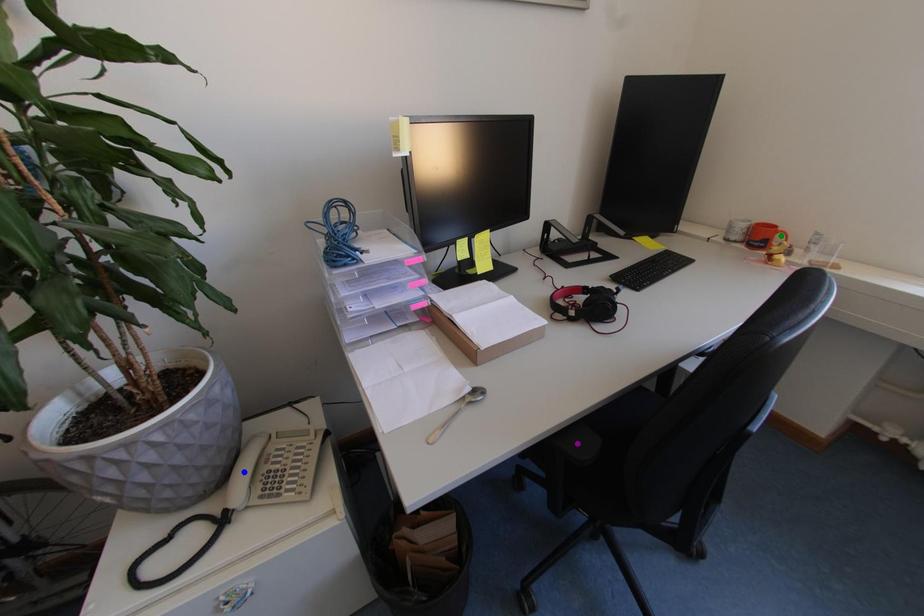
Order these from nearest to farthest:
green point
purple point
blue point

purple point → blue point → green point